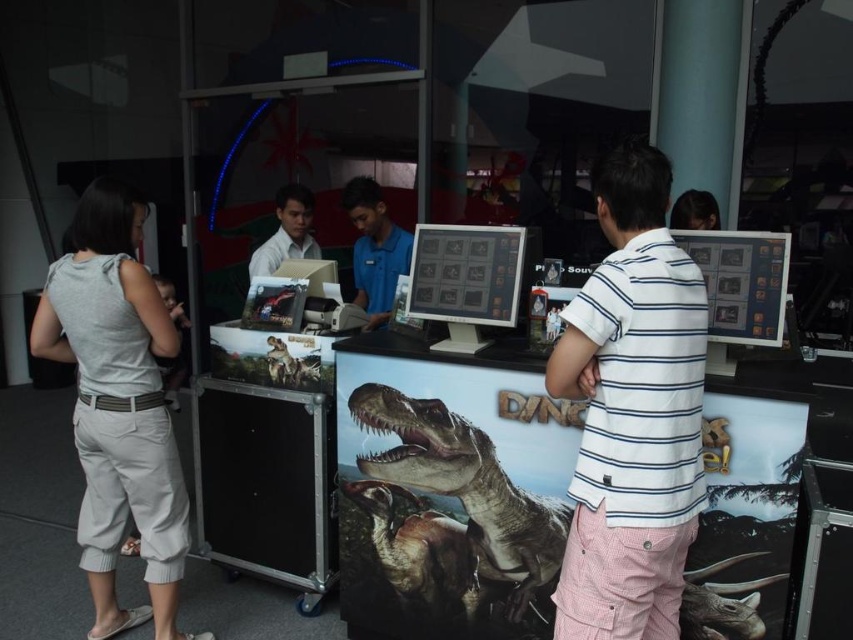
You are a photographer at the dinosaur exhibition. You want to take a photo of the shiny metallic dinosaur at center and the matte white shirt at center such that both are fully visible. Given that your camera can only capture a width of 1.2 meters, will the total width of both objects fit within the camera frame?

The shiny metallic dinosaur at center is wider than the matte white shirt at center. However, the exact combined width isn not provided. Without knowing the individual widths, we cannot determine if their total width fits within the camera frame.

You are a photographer at the dinosaur exhibition. You want to take a photo of the shiny metallic dinosaur at center and the matte white shirt at center so that both are clearly visible. Given their height difference, where should you position your camera to ensure both are in focus and properly framed?

Since the shiny metallic dinosaur at center is much taller than the matte white shirt at center, positioning the camera at a lower angle will allow both the top of the dinosaur and the person wearing the matte white shirt at center to be in focus and properly framed.